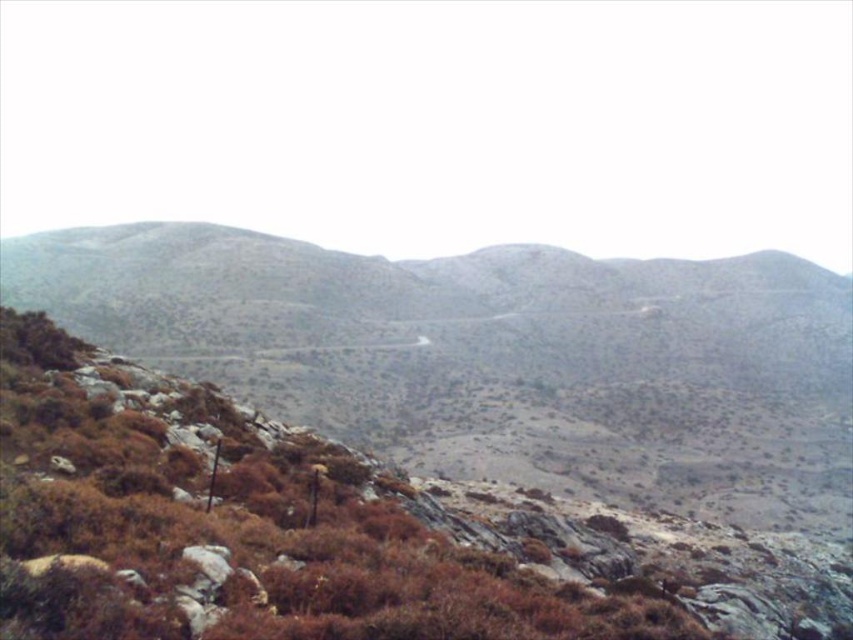
Question: Which of the following is the farthest from the observer?

Choices:
 (A) brown rocky mountain at lower left
 (B) brown shrubbery at center

Answer: (A)

Question: Which of the following is the farthest from the observer?

Choices:
 (A) brown shrubbery at center
 (B) brown rocky mountain at lower left

Answer: (B)

Question: Which object appears farthest from the camera in this image?

Choices:
 (A) brown shrubbery at center
 (B) brown rocky mountain at lower left

Answer: (B)

Question: Does brown rocky mountain at lower left have a lesser width compared to brown shrubbery at center?

Choices:
 (A) no
 (B) yes

Answer: (A)

Question: Is brown rocky mountain at lower left to the right of brown shrubbery at center from the viewer's perspective?

Choices:
 (A) no
 (B) yes

Answer: (B)

Question: Does brown rocky mountain at lower left have a greater width compared to brown shrubbery at center?

Choices:
 (A) no
 (B) yes

Answer: (B)